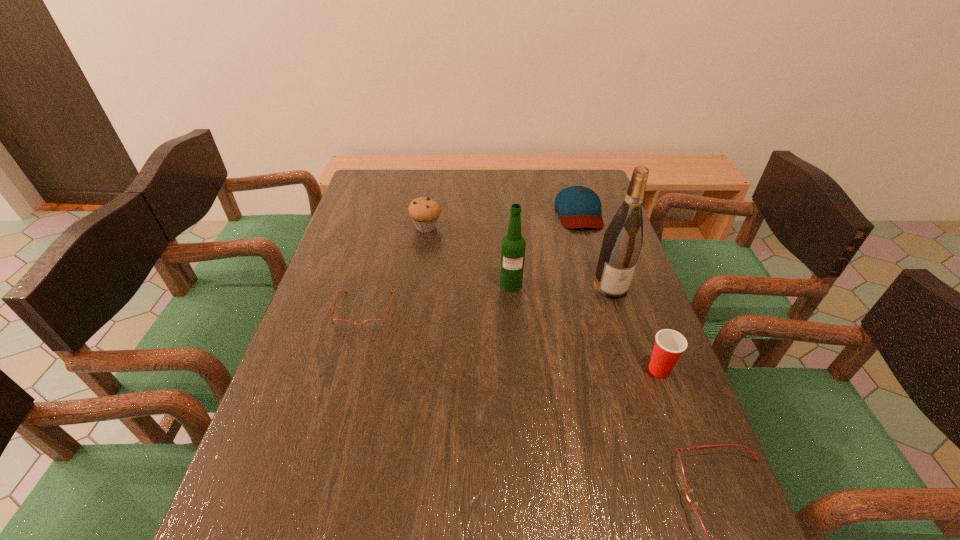
Locate an element on the screen. The width and height of the screenshot is (960, 540). free location at the far edge of the desktop is located at coordinates coord(468,193).

The width and height of the screenshot is (960, 540). What are the coordinates of `free space at the left edge of the desktop` in the screenshot? It's located at (356, 227).

The width and height of the screenshot is (960, 540). What are the coordinates of `free space at the right edge` in the screenshot? It's located at (598, 347).

Where is `vacant position at the far left corner of the desktop`? Image resolution: width=960 pixels, height=540 pixels. vacant position at the far left corner of the desktop is located at coordinates (392, 170).

Image resolution: width=960 pixels, height=540 pixels. I want to click on free space at the near left corner of the desktop, so click(324, 472).

This screenshot has width=960, height=540. I want to click on vacant space at the far right corner of the desktop, so click(598, 191).

At what (x,y) coordinates should I click in order to perform the action: click on free space between the beer bottle and the fifth tallest object. Please return your answer as a coordinate pair (x, y). This screenshot has width=960, height=540. Looking at the image, I should click on (545, 248).

Find the location of `blank region between the wine bottle and the beer bottle`. blank region between the wine bottle and the beer bottle is located at coordinates (561, 286).

The width and height of the screenshot is (960, 540). I want to click on unoccupied area between the wine bottle and the second nearest object, so click(x=635, y=328).

Find the location of a particular element. The width and height of the screenshot is (960, 540). free area in between the leftmost object and the baseball cap is located at coordinates (471, 261).